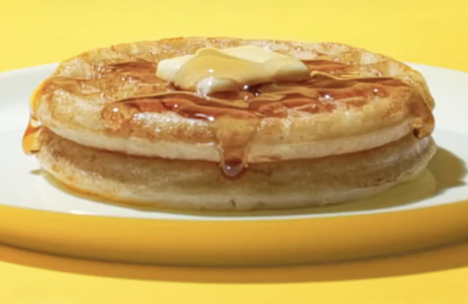
Locate an element on the screen. Image resolution: width=468 pixels, height=304 pixels. plate is located at coordinates (405, 205), (322, 137).